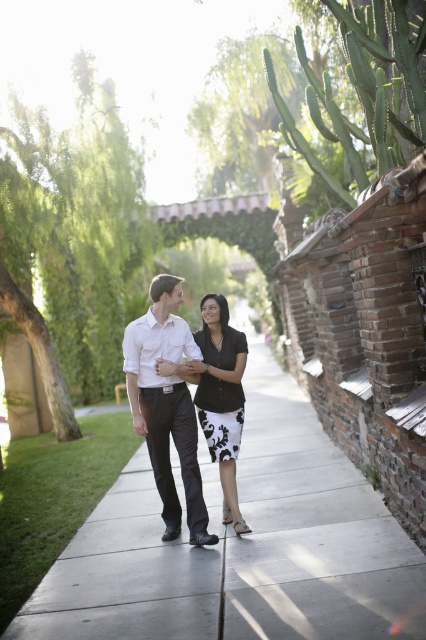
Question: Which object is positioned farthest from the white satin shirt at center?

Choices:
 (A) black textured dress at center
 (B) smooth concrete sidewalk at center
 (C) black matte dress at center

Answer: (B)

Question: Which point is farther to the camera?

Choices:
 (A) (340, 611)
 (B) (218, 353)

Answer: (B)

Question: Is white satin shirt at center wider than black matte dress at center?

Choices:
 (A) no
 (B) yes

Answer: (B)

Question: Among these points, which one is nearest to the camera?

Choices:
 (A) (339, 458)
 (B) (192, 346)

Answer: (B)

Question: Is smooth concrete sidewalk at center wider than white satin shirt at center?

Choices:
 (A) no
 (B) yes

Answer: (B)

Question: Does black matte dress at center have a larger size compared to black textured dress at center?

Choices:
 (A) no
 (B) yes

Answer: (B)